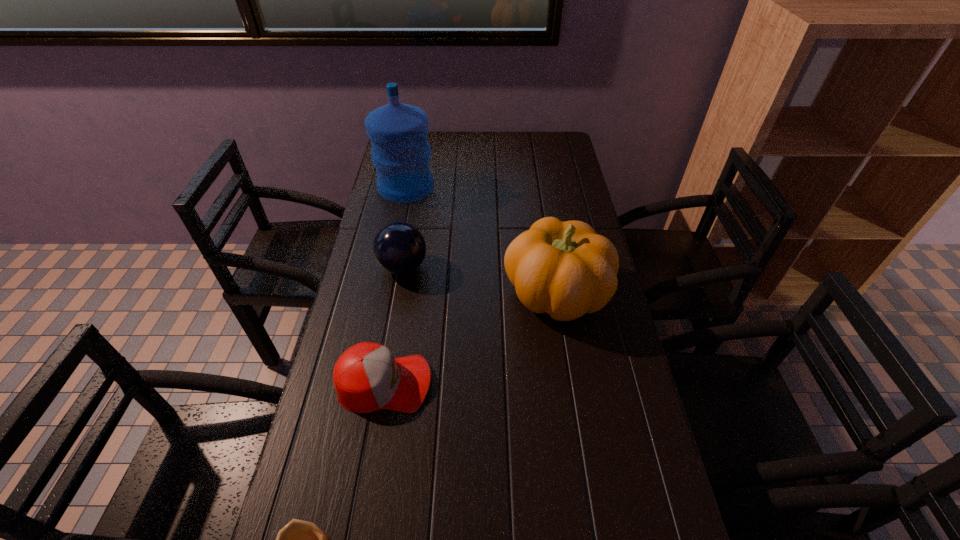
What are the coordinates of `free spot between the baseball cap and the tallest object` in the screenshot? It's located at (396, 285).

Locate an element on the screen. free spot between the second nearest object and the rightmost object is located at coordinates (470, 338).

Locate an element on the screen. The height and width of the screenshot is (540, 960). empty space between the fourth shortest object and the tallest object is located at coordinates [x=481, y=240].

Locate an element on the screen. This screenshot has height=540, width=960. free space between the third tallest object and the fourth farthest object is located at coordinates (394, 325).

The image size is (960, 540). I want to click on object that stands as the closest to the bowling ball, so click(x=565, y=269).

Locate an element on the screen. object that is the fourth closest to the fourth tallest object is located at coordinates (401, 154).

The image size is (960, 540). I want to click on free space that satisfies the following two spatial constraints: 1. on the surface of the pumpkin near the finger holes; 2. on the left side of the bowling ball, so click(398, 293).